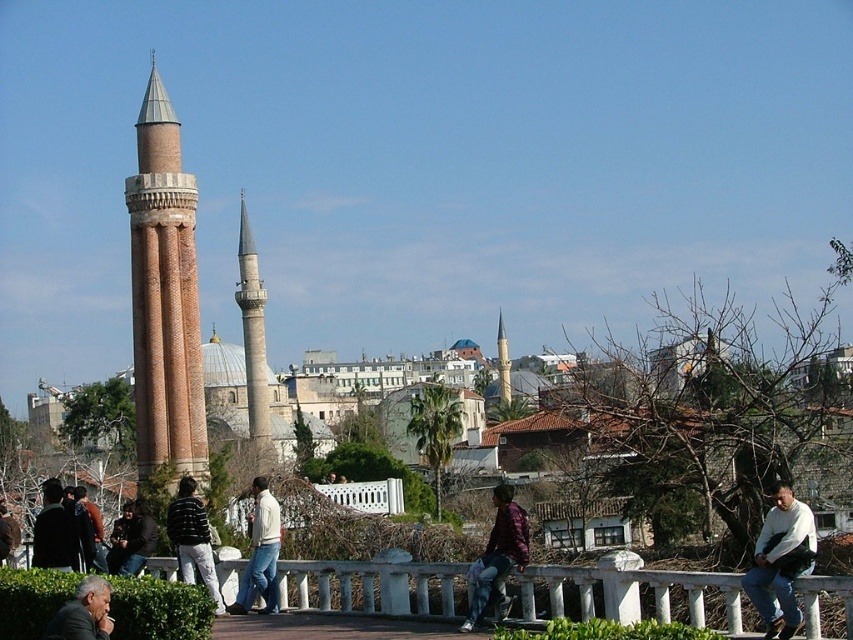
Does smooth gray minaret at center lie in front of maroon textured shirt at center?

No.

Who is more distant from viewer, (244,243) or (474,618)?

Positioned behind is point (244,243).

Find the location of `smooth gray minaret at center`. smooth gray minaret at center is located at coordinates (253, 342).

Where is `green leafy hedge at lower left`? The height and width of the screenshot is (640, 853). green leafy hedge at lower left is located at coordinates (158, 609).

Can you confirm if green leafy hedge at lower left is positioned below maroon textured shirt at center?

Incorrect, green leafy hedge at lower left is not positioned below maroon textured shirt at center.

Which is behind, point (35, 595) or point (492, 573)?

The point (492, 573) is behind.

The width and height of the screenshot is (853, 640). I want to click on green leafy hedge at lower left, so click(158, 609).

Does striped sweater at center have a greater height compared to dark gray suit at lower left?

Indeed, striped sweater at center has a greater height compared to dark gray suit at lower left.

Can you confirm if striped sweater at center is thinner than dark gray suit at lower left?

No, striped sweater at center is not thinner than dark gray suit at lower left.

Who is more forward, (183, 490) or (103, 593)?

Point (103, 593)

Where is `striped sweater at center`? The height and width of the screenshot is (640, 853). striped sweater at center is located at coordinates (192, 540).